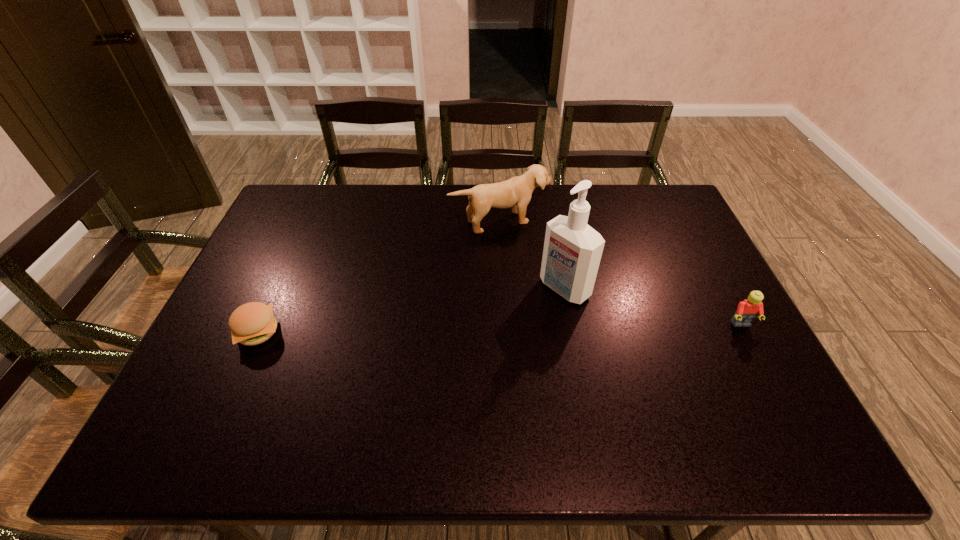
Find the location of a particular element. vacant space on the desktop that is between the leftmost object and the third tallest object and is positioned on the left side of the puppy is located at coordinates [564, 327].

Identify the location of free spot on the desktop that is between the leftmost object and the rightmost object and is positioned on the front label of the cleansing agent. This screenshot has width=960, height=540. (513, 328).